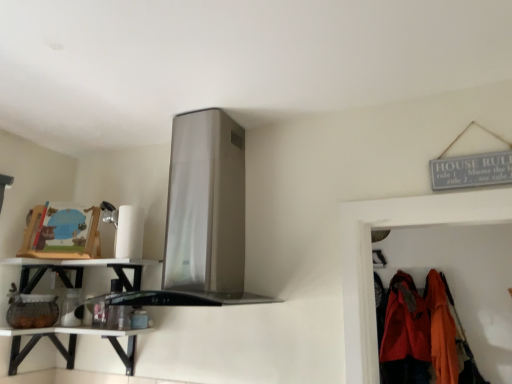
Question: Considering the positions of white glossy shelf at lower left and matte orange jacket at lower right, arranged as the first clothing when viewed from the left, in the image, is white glossy shelf at lower left bigger or smaller than matte orange jacket at lower right, arranged as the first clothing when viewed from the left,?

Choices:
 (A) big
 (B) small

Answer: (A)

Question: From a real-world perspective, is white glossy shelf at lower left positioned above or below matte orange jacket at lower right, which is the second clothing from right to left?

Choices:
 (A) above
 (B) below

Answer: (A)

Question: Estimate the real-world distances between objects in this image. Which object is closer to the matte orange jacket at lower right, arranged as the first clothing when viewed from the left?

Choices:
 (A) satin silver exhaust hood at upper center
 (B) white glossy shelf at lower left
 (C) white glossy shelf at lower left
 (D) orange fabric coat at right, the second clothing in the left-to-right sequence

Answer: (D)

Question: Estimate the real-world distances between objects in this image. Which object is closer to the white glossy shelf at lower left?

Choices:
 (A) white glossy shelf at lower left
 (B) orange fabric coat at right, acting as the first clothing starting from the right
 (C) matte orange jacket at lower right, arranged as the first clothing when viewed from the left
 (D) satin silver exhaust hood at upper center

Answer: (A)